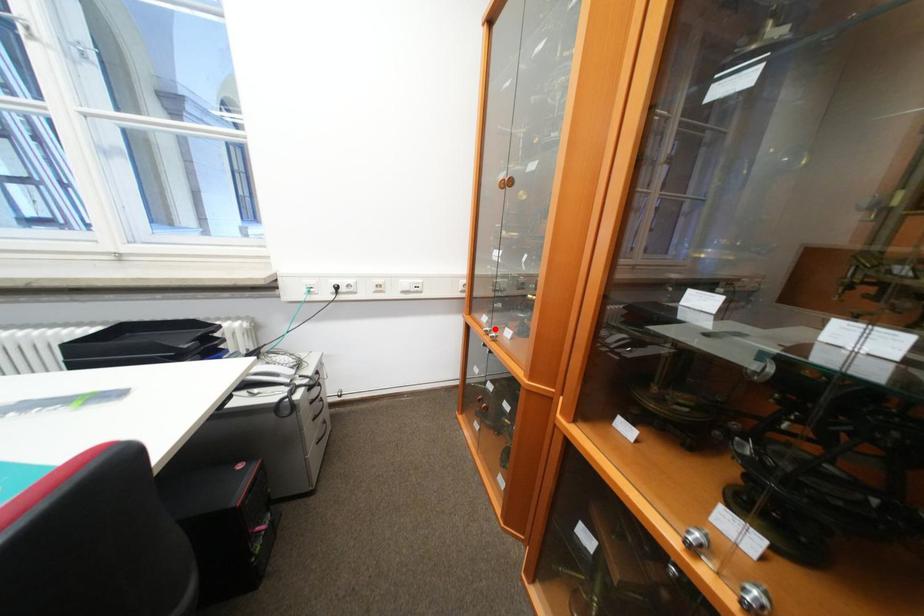
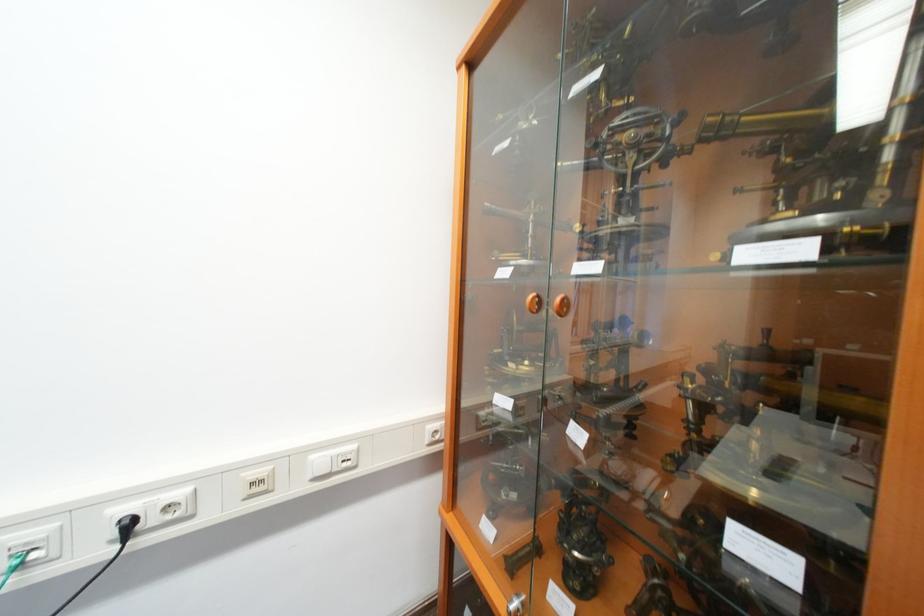
Question: I am providing you with two images of the same scene from different viewpoints. A red point is marked on the first image. Can you still see the location of the red point in image 2?

Choices:
 (A) Yes
 (B) No

Answer: (A)